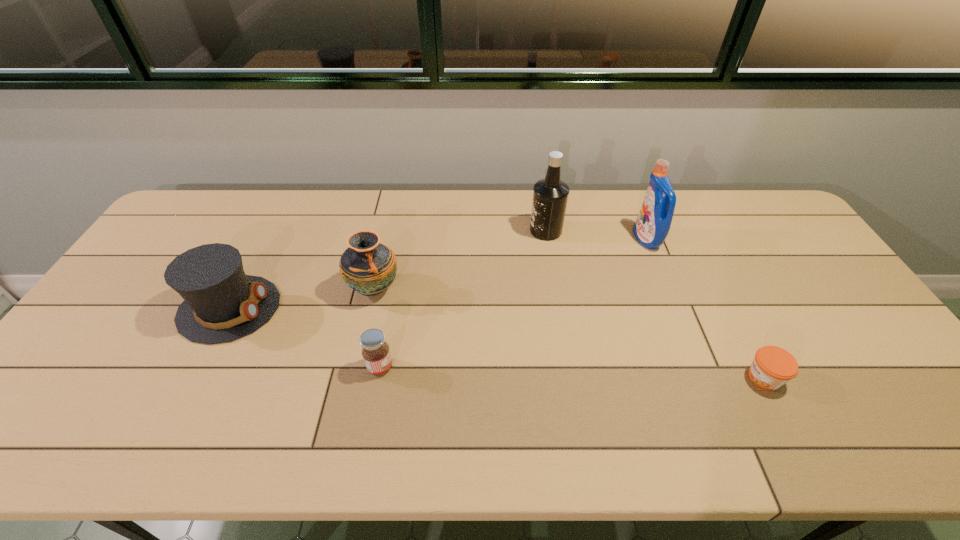
I want to click on liquor, so click(550, 195).

The width and height of the screenshot is (960, 540). I want to click on detergent, so click(x=653, y=223).

I want to click on pottery, so click(x=368, y=267).

You are a GUI agent. You are given a task and a screenshot of the screen. Output one action in this format:
    pyautogui.click(x=<x>, y=<y>)
    Task: Click on the leftmost object
    This screenshot has width=960, height=540.
    Given the screenshot: What is the action you would take?
    pyautogui.click(x=221, y=304)

This screenshot has width=960, height=540. Identify the location of the third shortest object. (221, 304).

What are the coordinates of `the fifth tallest object` in the screenshot? It's located at (375, 351).

Locate an element on the screen. The image size is (960, 540). the left jam is located at coordinates (375, 351).

Find the location of a particular element. The image size is (960, 540). the rightmost object is located at coordinates (772, 367).

Find the location of `the right jam`. the right jam is located at coordinates (772, 367).

Locate an element on the screen. This screenshot has height=540, width=960. free spot located 0.080m on the front label of the third object from right to left is located at coordinates (505, 231).